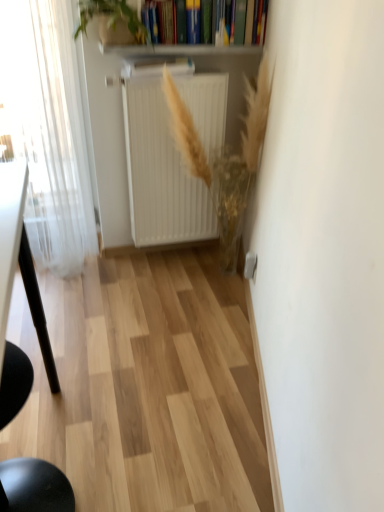
You are a GUI agent. You are given a task and a screenshot of the screen. Output one action in this format:
    pyautogui.click(x=<x>, y=<y>)
    Task: Click on the white glossy radiator at upper center
    The height and width of the screenshot is (512, 384).
    Given the screenshot: What is the action you would take?
    pyautogui.click(x=180, y=50)

Describe the element at coordinates (256, 24) in the screenshot. I see `hardcover book at upper center` at that location.

I want to click on black matte chair at lower left, so click(x=34, y=487).

The image size is (384, 512). In order to click on white glossy radiator at upper center in this screenshot , I will do `click(180, 50)`.

How many degrees apart are the facing directions of golden textured plant at center, acting as the first plant starting from the right, and hardcover book at upper center?

The facing directions of golden textured plant at center, acting as the first plant starting from the right, and hardcover book at upper center are 93.8 degrees apart.

Between golden textured plant at center, acting as the first plant starting from the right, and hardcover book at upper center, which one is positioned behind?

hardcover book at upper center.

Is point (250, 97) farther from camera compared to point (145, 21)?

Yes, it is.

Considering the positions of objects black matte chair at lower left and hardcover book at upper center in the image provided, who is behind, black matte chair at lower left or hardcover book at upper center?

hardcover book at upper center is more distant.

Between black matte chair at lower left and hardcover book at upper center, which one has larger size?

black matte chair at lower left is bigger.

Can you confirm if black matte chair at lower left is positioned to the left of hardcover book at upper center?

Correct, you'll find black matte chair at lower left to the left of hardcover book at upper center.

From a real-world perspective, is black matte chair at lower left physically below hardcover book at upper center?

Yes, from a real-world perspective, black matte chair at lower left is under hardcover book at upper center.

From a real-world perspective, which object rests below the other?

green leafy plant at upper center, the 2th plant in the right-to-left sequence.

Find the location of a particular element. The image size is (384, 512). book above the green leafy plant at upper center, the first plant positioned from the left (from the image's perspective) is located at coordinates (256, 24).

What's the angular difference between hardcover book at upper center and green leafy plant at upper center, the 2th plant in the right-to-left sequence,'s facing directions?

The angular difference between hardcover book at upper center and green leafy plant at upper center, the 2th plant in the right-to-left sequence, is 0.0583 degrees.

Could you tell me if hardcover book at upper center is facing green leafy plant at upper center, arranged as the second plant when ordered from the bottom?

No, hardcover book at upper center does not turn towards green leafy plant at upper center, arranged as the second plant when ordered from the bottom.

Which point is more distant from viewer, (162,95) or (62,223)?

The point (62,223) is farther from the camera.

I want to click on window that is above the white matte radiator at center (from the image's perspective), so click(x=48, y=130).

Between white matte radiator at center and white sheer curtain at left, which one is positioned behind?

Positioned behind is white matte radiator at center.

Who is bigger, white matte radiator at center or white sheer curtain at left?

white sheer curtain at left.

Is green leafy plant at upper center, the 2th plant in the right-to-left sequence, further to camera compared to white glossy radiator at upper center?

No, green leafy plant at upper center, the 2th plant in the right-to-left sequence, is closer to the camera.

Which of these two, green leafy plant at upper center, arranged as the second plant when ordered from the bottom, or white glossy radiator at upper center, is smaller?

Smaller between the two is white glossy radiator at upper center.

From a real-world perspective, between green leafy plant at upper center, which is the 1th plant in top-to-bottom order, and white glossy radiator at upper center, who is vertically lower?

In real-world perspective, white glossy radiator at upper center is lower.

How far apart are green leafy plant at upper center, the 2th plant in the right-to-left sequence, and white glossy radiator at upper center?

green leafy plant at upper center, the 2th plant in the right-to-left sequence, is 6.10 inches from white glossy radiator at upper center.

What are the coordinates of `radiator on the left of hardcover book at upper center` in the screenshot? It's located at (159, 170).

Would you say white matte radiator at center is a long distance from hardcover book at upper center?

That's not correct — white matte radiator at center is a little close to hardcover book at upper center.

Which is nearer, (190, 202) or (258, 31)?

Point (190, 202).

From a real-world perspective, relative to hardcover book at upper center, is white matte radiator at center vertically above or below?

Clearly, from a real-world perspective, white matte radiator at center is below hardcover book at upper center.

From a real-world perspective, is white glossy radiator at upper center above or below hardcover book at upper center?

white glossy radiator at upper center is situated lower than hardcover book at upper center in the real world.

Who is taller, white glossy radiator at upper center or hardcover book at upper center?

hardcover book at upper center.

Between point (146, 54) and point (246, 21), which one is positioned in front?

The point (246, 21) is closer.

Would you say white glossy radiator at upper center is a long distance from hardcover book at upper center?

They are positioned close to each other.

You are a GUI agent. You are given a task and a screenshot of the screen. Output one action in this format:
    pyautogui.click(x=<x>, y=<y>)
    Task: Click on the plant that is the 1st object to the left of the hardcover book at upper center, starting at the anchor
    The image size is (384, 512).
    Given the screenshot: What is the action you would take?
    pyautogui.click(x=224, y=157)

Find the location of a particular element. Image resolution: width=384 pixels, height=512 pixels. chair below the hardcover book at upper center (from the image's perspective) is located at coordinates (34, 487).

From the image, which object appears to be farther from green leafy plant at upper center, the 2th plant in the right-to-left sequence, white sheer curtain at left or black matte chair at lower left?

black matte chair at lower left lies further to green leafy plant at upper center, the 2th plant in the right-to-left sequence, than the other object.

From the image, which object appears to be nearer to white sheer curtain at left, hardcover book at upper center or black matte chair at lower left?

hardcover book at upper center is closer to white sheer curtain at left.

When comparing their distances from green leafy plant at upper center, the first plant positioned from the left, does golden textured plant at center, positioned as the second plant in left-to-right order, or white sheer curtain at left seem further?

golden textured plant at center, positioned as the second plant in left-to-right order, is positioned further to the anchor green leafy plant at upper center, the first plant positioned from the left.

When comparing their distances from white sheer curtain at left, does white matte radiator at center or white glossy radiator at upper center seem closer?

white matte radiator at center.

Based on their spatial positions, is white glossy radiator at upper center or hardcover book at upper center closer to white sheer curtain at left?

white glossy radiator at upper center is closer to white sheer curtain at left.

Looking at the image, which one is located further to white sheer curtain at left, green leafy plant at upper center, the first plant positioned from the left, or white glossy radiator at upper center?

white glossy radiator at upper center lies further to white sheer curtain at left than the other object.

Estimate the real-world distances between objects in this image. Which object is further from green leafy plant at upper center, arranged as the second plant when ordered from the bottom, white glossy radiator at upper center or golden textured plant at center, arranged as the 1th plant when ordered from the bottom?

Among the two, golden textured plant at center, arranged as the 1th plant when ordered from the bottom, is located further to green leafy plant at upper center, arranged as the second plant when ordered from the bottom.

Based on their spatial positions, is golden textured plant at center, positioned as the second plant in left-to-right order, or white matte radiator at center closer to hardcover book at upper center?

The object closer to hardcover book at upper center is golden textured plant at center, positioned as the second plant in left-to-right order.

Identify the location of window sill between green leafy plant at upper center, the first plant positioned from the left, and black matte chair at lower left in the up-down direction. This screenshot has width=384, height=512. (180, 50).

Where is `plant located between white sheer curtain at left and white matte radiator at center in the left-right direction`? This screenshot has height=512, width=384. plant located between white sheer curtain at left and white matte radiator at center in the left-right direction is located at coordinates (112, 18).

Where is `window sill between hardcover book at upper center and black matte chair at lower left vertically`? window sill between hardcover book at upper center and black matte chair at lower left vertically is located at coordinates (180, 50).

I want to click on window between hardcover book at upper center and black matte chair at lower left vertically, so click(48, 130).